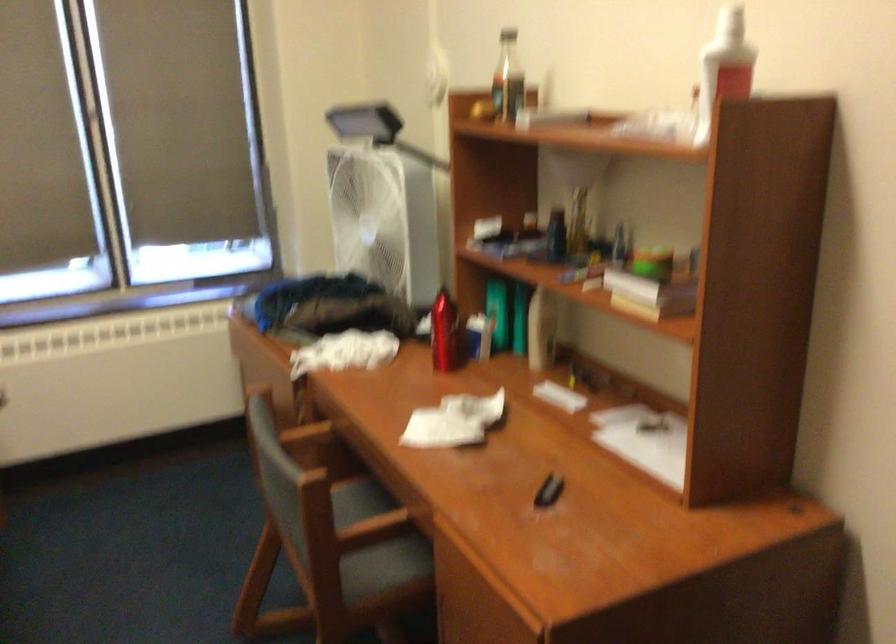
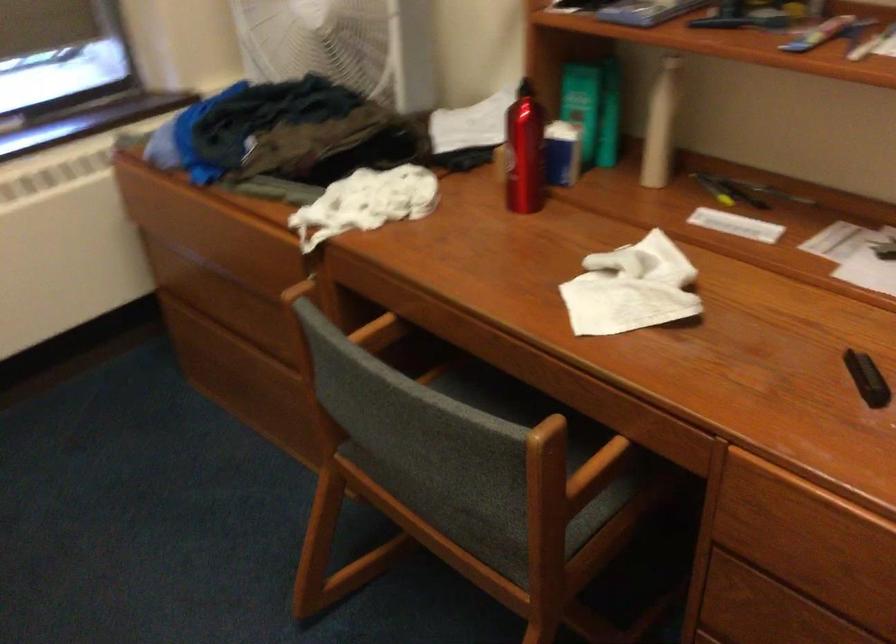
Where in the second image is the point corresponding to (x=437, y=330) from the first image?

(524, 152)